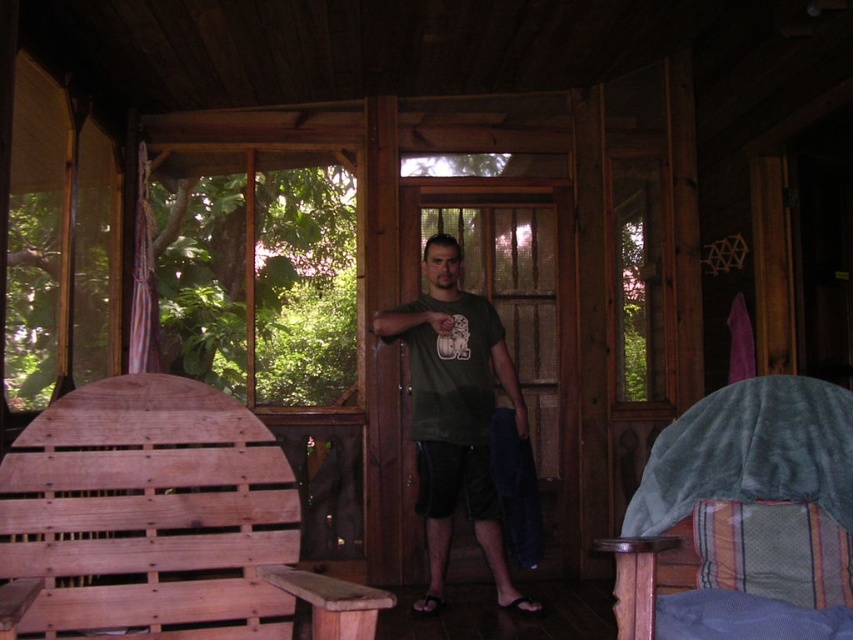
You are planning to place a large potted plant that requires a sturdy support. Based on the scene, which object between the wooden chair at left and the velvet green bed at right would be more suitable for placing the plant?

The wooden chair at left is larger in size than the velvet green bed at right, making it more stable and suitable for placing the large potted plant.